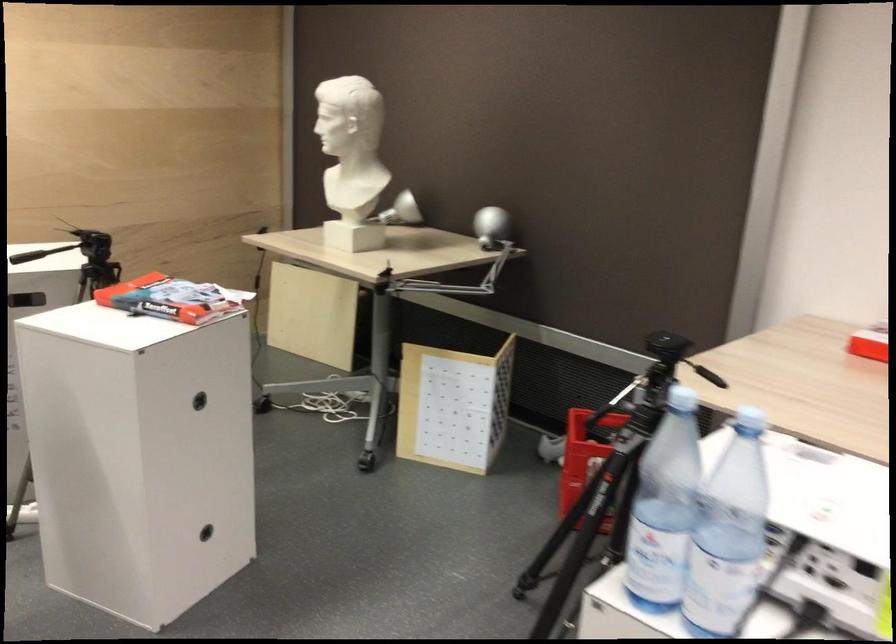
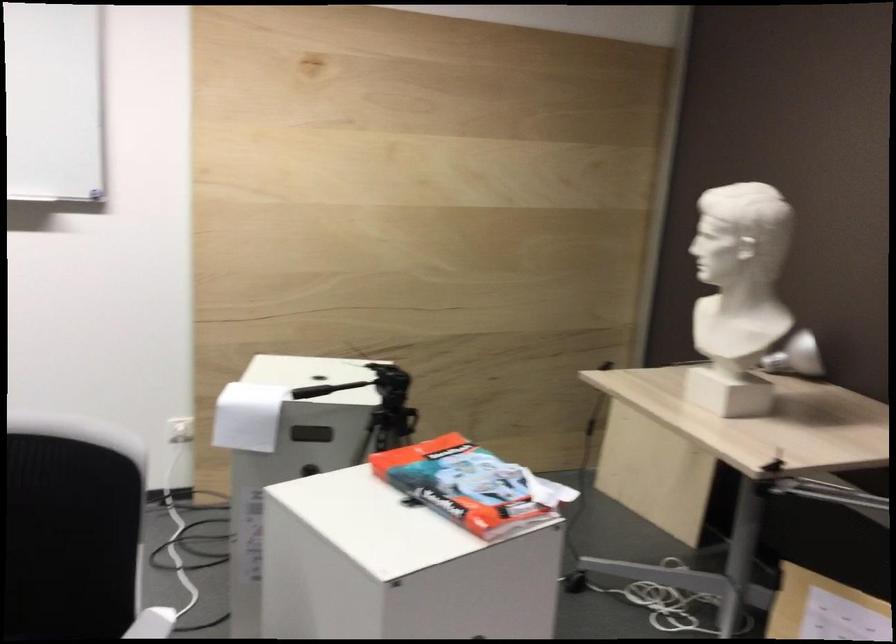
Find the pixel in the second image that matches point 350,154 in the first image.

(746, 281)